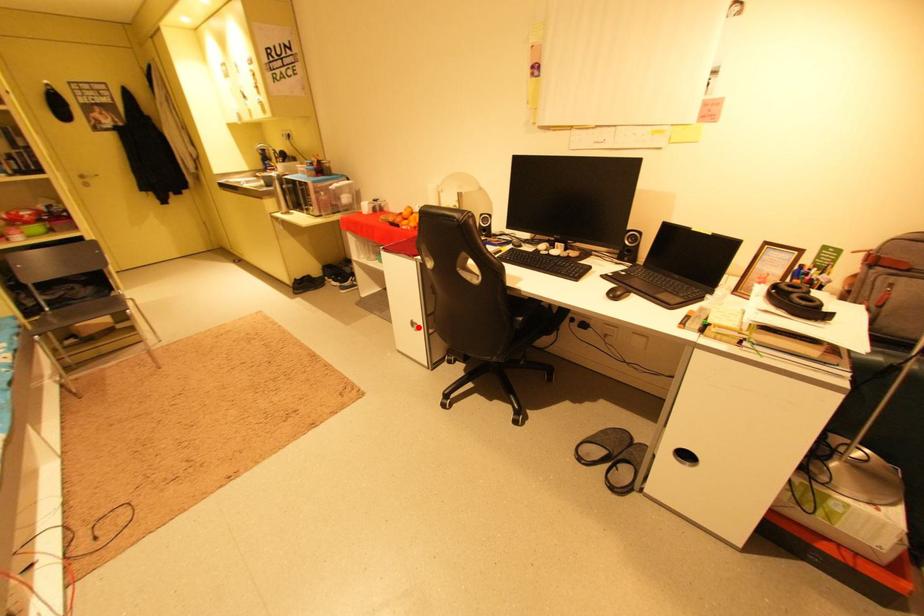
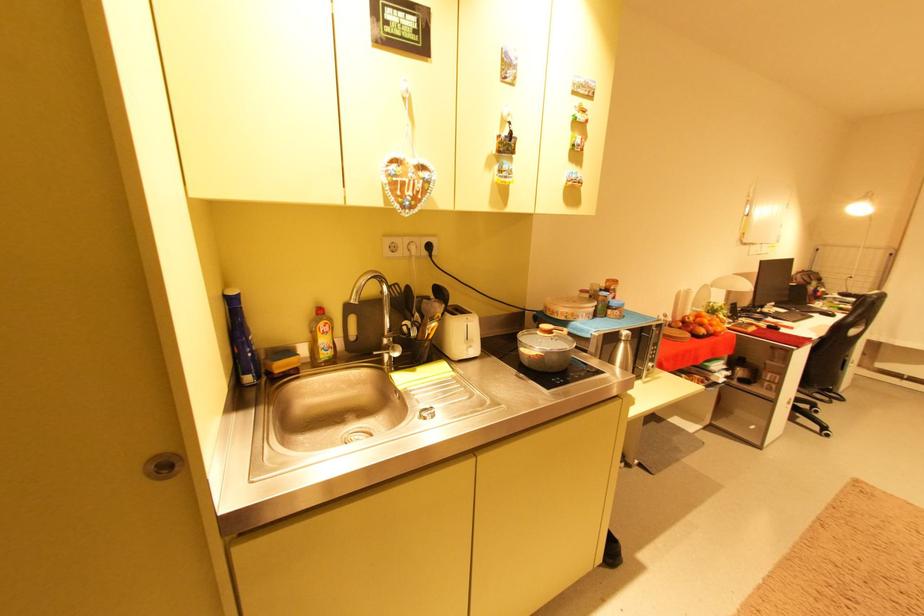
Find the pixel in the second image that matches the highlighted location in the first image.

(796, 407)